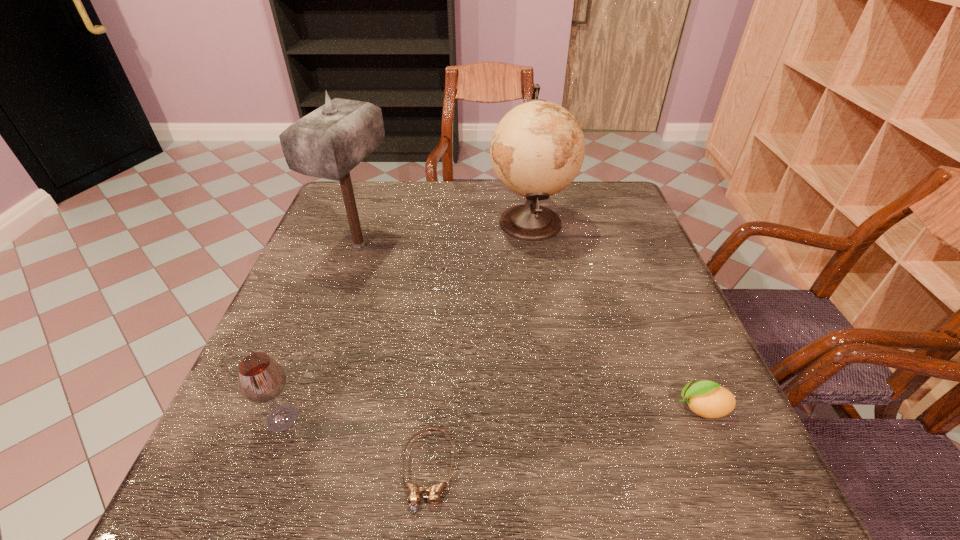
Image resolution: width=960 pixels, height=540 pixels. I want to click on mallet, so click(329, 142).

The image size is (960, 540). I want to click on the fourth object from left to right, so click(x=537, y=149).

You are a GUI agent. You are given a task and a screenshot of the screen. Output one action in this format:
    pyautogui.click(x=<x>, y=<y>)
    Task: Click on the second tallest object
    The height and width of the screenshot is (540, 960).
    Given the screenshot: What is the action you would take?
    pyautogui.click(x=537, y=149)

Locate an element on the screen. the third tallest object is located at coordinates (262, 379).

The height and width of the screenshot is (540, 960). Find the location of `lemon`. lemon is located at coordinates (708, 399).

What are the coordinates of `the rightmost object` in the screenshot? It's located at (708, 399).

Locate an element on the screen. goggles is located at coordinates (415, 492).

Find the location of `the shortest object`. the shortest object is located at coordinates (415, 492).

What are the coordinates of `free space located on the right of the mallet` in the screenshot? It's located at (507, 245).

Find the location of a particular element. free space located on the front-facing side of the second object from right to left is located at coordinates [405, 222].